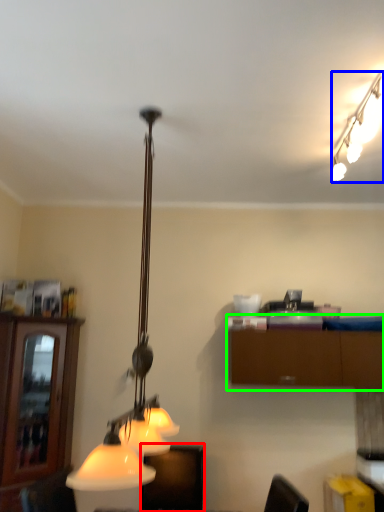
Question: Which is farther away from furniture (highlighted by a red box)? lamp (highlighted by a blue box) or cabinetry (highlighted by a green box)?

Choices:
 (A) lamp
 (B) cabinetry

Answer: (A)